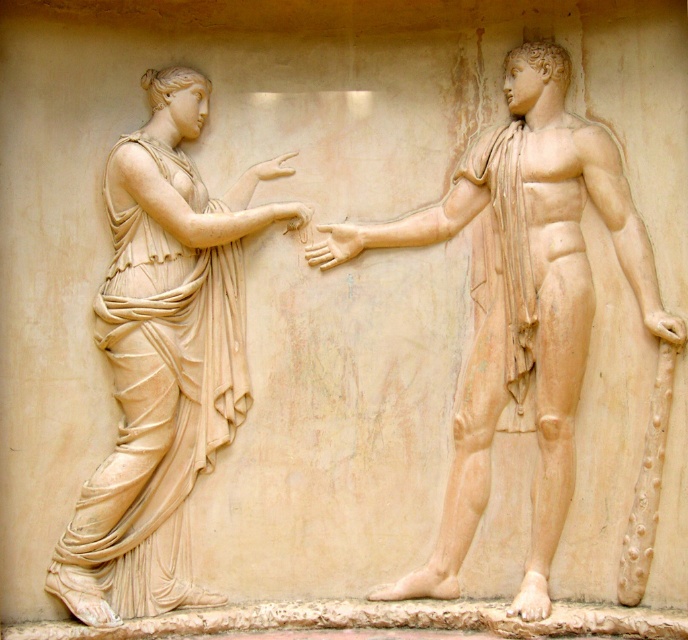
Is marble statue at right positioned at the back of matte beige draped figure at left?

No, it is not.

Is point (568, 147) in front of point (155, 476)?

Yes, it is.

Does point (506, 404) come in front of point (202, 604)?

Yes.

You are a GUI agent. You are given a task and a screenshot of the screen. Output one action in this format:
    pyautogui.click(x=<x>, y=<y>)
    Task: Click on the marble statue at right
    The height and width of the screenshot is (640, 688).
    Given the screenshot: What is the action you would take?
    pyautogui.click(x=522, y=305)